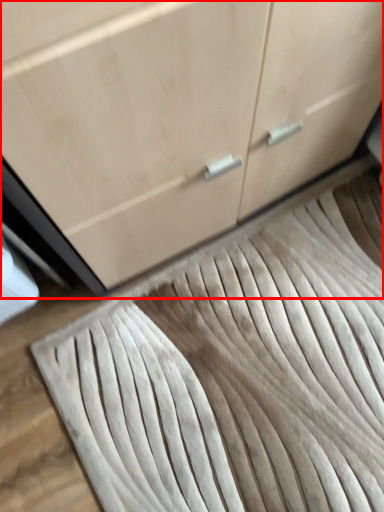
Question: From the image's perspective, what is the correct spatial relationship of cabinetry (annotated by the red box) in relation to doormat?

Choices:
 (A) below
 (B) above

Answer: (B)